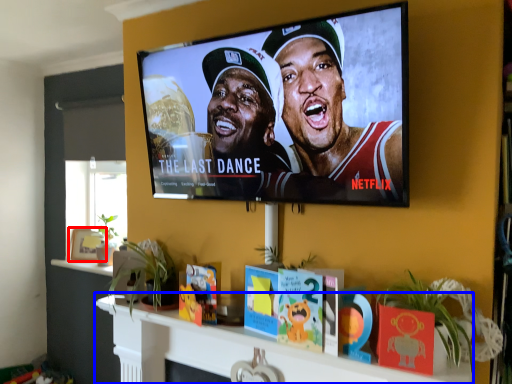
Question: Which of the following is the farthest to the observer, picture frame (highlighted by a red box) or shelf (highlighted by a blue box)?

Choices:
 (A) picture frame
 (B) shelf

Answer: (A)